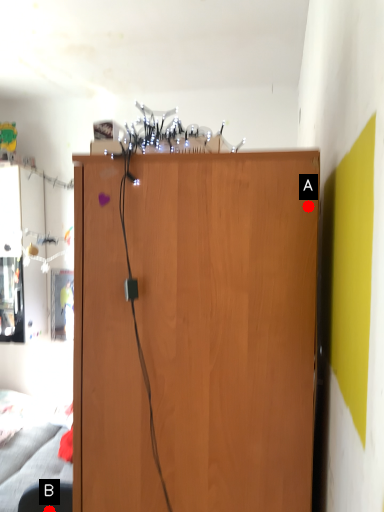
Question: Two points are circled on the image, labeled by A and B beside each circle. Which point is closer to the camera?

Choices:
 (A) A is closer
 (B) B is closer

Answer: (A)